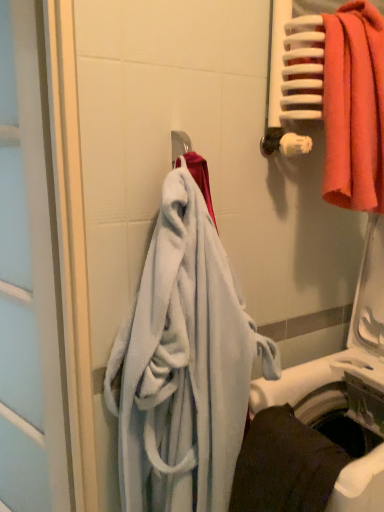
Question: From the image's perspective, is white plastic washing machine at lower right positioned above or below matte orange towel at upper right, marked as the first towel in a top-to-bottom arrangement?

Choices:
 (A) below
 (B) above

Answer: (A)

Question: Is white plastic washing machine at lower right in front of or behind matte orange towel at upper right, the third towel from the bottom, in the image?

Choices:
 (A) behind
 (B) front

Answer: (B)

Question: Which of these objects is positioned farthest from the white plastic washing machine at lower right?

Choices:
 (A) dark gray fabric towel at lower right, which is counted as the first towel, starting from the bottom
 (B) matte orange towel at upper right, the third towel from the bottom
 (C) soft blue towel at center, the 2th towel when ordered from bottom to top
 (D) white glossy screen door at left

Answer: (D)

Question: Which of these objects is positioned closest to the white glossy screen door at left?

Choices:
 (A) soft blue towel at center, acting as the 2th towel starting from the top
 (B) white plastic washing machine at lower right
 (C) matte orange towel at upper right, marked as the first towel in a top-to-bottom arrangement
 (D) dark gray fabric towel at lower right, which is counted as the first towel, starting from the bottom

Answer: (A)